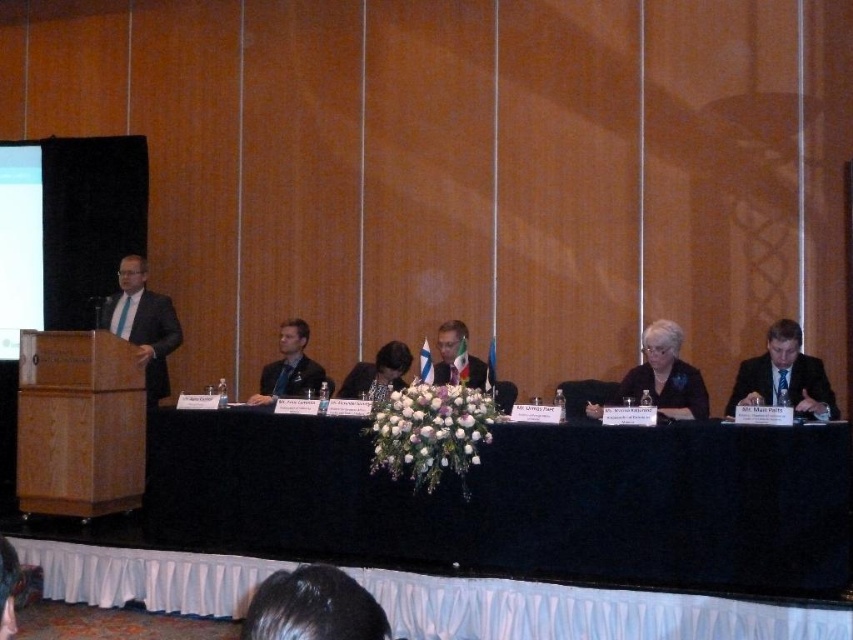
Which is behind, point (672, 410) or point (409, 360)?

The point (409, 360) is more distant.

Describe the element at coordinates (665, 376) in the screenshot. I see `matte black dress at center` at that location.

The height and width of the screenshot is (640, 853). Identify the location of matte black dress at center. (665, 376).

The width and height of the screenshot is (853, 640). What do you see at coordinates (312, 608) in the screenshot?
I see `dark brown hair at lower center` at bounding box center [312, 608].

Between dark brown hair at lower center and matte black suit at left, which one appears on the left side from the viewer's perspective?

Positioned to the left is matte black suit at left.

Describe the element at coordinates (312, 608) in the screenshot. Image resolution: width=853 pixels, height=640 pixels. I see `dark brown hair at lower center` at that location.

This screenshot has width=853, height=640. Find the location of `dark brown hair at lower center`. dark brown hair at lower center is located at coordinates (312, 608).

Who is positioned more to the left, black fabric table at center or formal suit at center?

black fabric table at center is more to the left.

Is point (834, 486) positioned in front of point (492, 371)?

That is True.

Where is `black fabric table at center`? This screenshot has width=853, height=640. black fabric table at center is located at coordinates (518, 500).

Find the location of `black fabric table at center`. black fabric table at center is located at coordinates (518, 500).